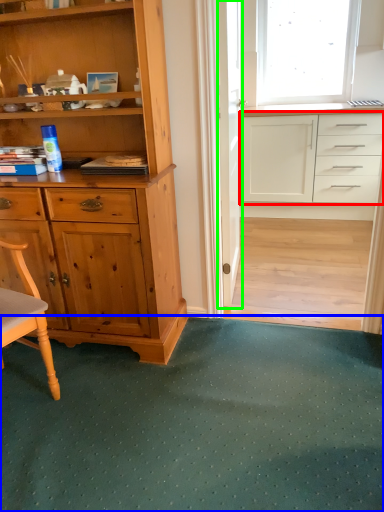
Question: Based on their relative distances, which object is nearer to cabinetry (highlighted by a red box)? Choose from doormat (highlighted by a blue box) and screen door (highlighted by a green box).

Choices:
 (A) doormat
 (B) screen door

Answer: (B)